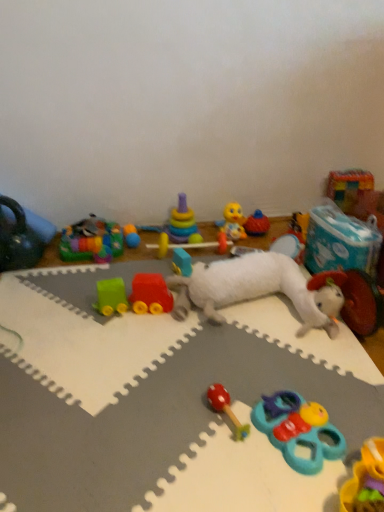
The height and width of the screenshot is (512, 384). Identify the location of vacant area that lies to the right of blue rubber toy at lower right, arranged as the eleventh toy when viewed from the left. (357, 406).